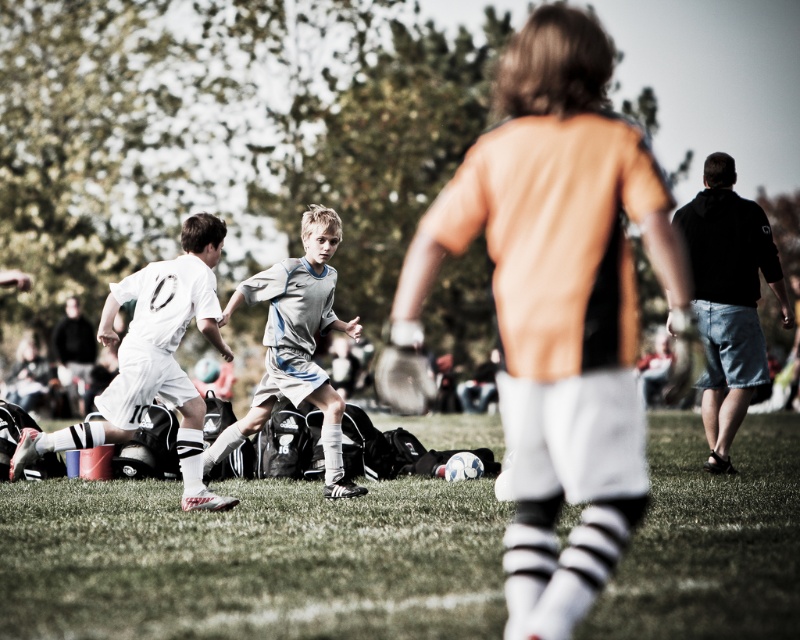
Question: Which point appears farthest from the camera in this image?

Choices:
 (A) (758, 211)
 (B) (546, 180)
 (C) (312, 262)
 (D) (200, 294)

Answer: (A)

Question: Does orange matte jersey at center appear on the left side of gray matte soccer jersey at center?

Choices:
 (A) no
 (B) yes

Answer: (A)

Question: Where is black cotton hoodie at right located in relation to dark gray hoodie at left in the image?

Choices:
 (A) left
 (B) right

Answer: (B)

Question: Among these points, which one is nearest to the camera?

Choices:
 (A) (84, 410)
 (B) (616, 234)
 (C) (30, 460)
 (D) (322, 240)

Answer: (B)

Question: Estimate the real-world distances between objects in this image. Which object is farther from the dark gray hoodie at left?

Choices:
 (A) gray matte soccer jersey at center
 (B) orange matte jersey at center

Answer: (A)

Question: Can you confirm if orange matte jersey at center is smaller than dark gray hoodie at left?

Choices:
 (A) yes
 (B) no

Answer: (B)